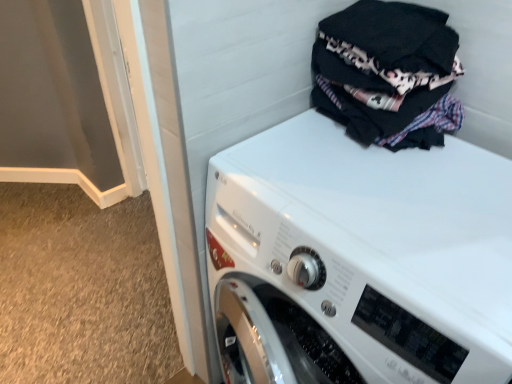
You are a GUI agent. You are given a task and a screenshot of the screen. Output one action in this format:
    pyautogui.click(x=<x>, y=<y>)
    Task: Click on the black cotton laundry at upper right
    
    Given the screenshot: What is the action you would take?
    pyautogui.click(x=389, y=73)

The width and height of the screenshot is (512, 384). What do you see at coordinates (389, 73) in the screenshot?
I see `black cotton laundry at upper right` at bounding box center [389, 73].

The width and height of the screenshot is (512, 384). In order to click on white glossy washing machine at upper right in this screenshot , I will do `click(359, 260)`.

This screenshot has width=512, height=384. Describe the element at coordinates (359, 260) in the screenshot. I see `white glossy washing machine at upper right` at that location.

Find the location of a particular element. This screenshot has width=512, height=384. black cotton laundry at upper right is located at coordinates (389, 73).

Between black cotton laundry at upper right and white glossy washing machine at upper right, which one appears on the right side from the viewer's perspective?

From the viewer's perspective, black cotton laundry at upper right appears more on the right side.

Does black cotton laundry at upper right lie in front of white glossy washing machine at upper right?

No, black cotton laundry at upper right is further to the viewer.

Is point (402, 111) positioned in front of point (283, 294)?

Yes, point (402, 111) is in front of point (283, 294).

From the image's perspective, is black cotton laundry at upper right below white glossy washing machine at upper right?

No, from the image's perspective, black cotton laundry at upper right is not beneath white glossy washing machine at upper right.

From a real-world perspective, relative to white glossy washing machine at upper right, is black cotton laundry at upper right vertically above or below?

black cotton laundry at upper right is situated higher than white glossy washing machine at upper right in the real world.

Can you confirm if black cotton laundry at upper right is thinner than white glossy washing machine at upper right?

Correct, the width of black cotton laundry at upper right is less than that of white glossy washing machine at upper right.

Looking at this image, from their relative heights in the image, would you say black cotton laundry at upper right is taller or shorter than white glossy washing machine at upper right?

In the image, black cotton laundry at upper right appears to be shorter than white glossy washing machine at upper right.

Looking at this image, between black cotton laundry at upper right and white glossy washing machine at upper right, which one has smaller size?

Smaller between the two is black cotton laundry at upper right.

Is black cotton laundry at upper right positioned beyond the bounds of white glossy washing machine at upper right?

Yes, black cotton laundry at upper right is outside of white glossy washing machine at upper right.

Are black cotton laundry at upper right and white glossy washing machine at upper right far apart?

black cotton laundry at upper right is actually quite close to white glossy washing machine at upper right.

Could you tell me if black cotton laundry at upper right is facing white glossy washing machine at upper right?

No, black cotton laundry at upper right does not turn towards white glossy washing machine at upper right.

Could you measure the distance between black cotton laundry at upper right and white glossy washing machine at upper right?

They are 9.23 inches apart.

The width and height of the screenshot is (512, 384). I want to click on washing machine below the black cotton laundry at upper right (from the image's perspective), so click(359, 260).

In the scene shown: Does white glossy washing machine at upper right appear on the right side of black cotton laundry at upper right?

No, white glossy washing machine at upper right is not to the right of black cotton laundry at upper right.

Does white glossy washing machine at upper right lie in front of black cotton laundry at upper right?

Yes, white glossy washing machine at upper right is closer to the camera.

Does point (319, 193) come in front of point (356, 93)?

Yes.

From the image's perspective, is white glossy washing machine at upper right located beneath black cotton laundry at upper right?

Yes, from the image's perspective, white glossy washing machine at upper right is beneath black cotton laundry at upper right.

From a real-world perspective, is white glossy washing machine at upper right below black cotton laundry at upper right?

Yes.

Consider the image. Which object is thinner, white glossy washing machine at upper right or black cotton laundry at upper right?

Thinner between the two is black cotton laundry at upper right.

From their relative heights in the image, would you say white glossy washing machine at upper right is taller or shorter than black cotton laundry at upper right?

white glossy washing machine at upper right is taller than black cotton laundry at upper right.

Can you confirm if white glossy washing machine at upper right is smaller than black cotton laundry at upper right?

Actually, white glossy washing machine at upper right might be larger than black cotton laundry at upper right.

Would you say white glossy washing machine at upper right is inside or outside black cotton laundry at upper right?

white glossy washing machine at upper right is not enclosed by black cotton laundry at upper right.

Is white glossy washing machine at upper right far away from black cotton laundry at upper right?

No.

Does white glossy washing machine at upper right turn towards black cotton laundry at upper right?

No, white glossy washing machine at upper right is not turned towards black cotton laundry at upper right.

How much distance is there between white glossy washing machine at upper right and black cotton laundry at upper right?

white glossy washing machine at upper right is 9.23 inches away from black cotton laundry at upper right.

What are the coordinates of `washing machine located underneath the black cotton laundry at upper right (from a real-world perspective)` in the screenshot? It's located at (359, 260).

Where is `laundry behind the white glossy washing machine at upper right`? laundry behind the white glossy washing machine at upper right is located at coordinates (389, 73).

At what (x,y) coordinates should I click in order to perform the action: click on washing machine below the black cotton laundry at upper right (from a real-world perspective). Please return your answer as a coordinate pair (x, y). This screenshot has width=512, height=384. Looking at the image, I should click on (359, 260).